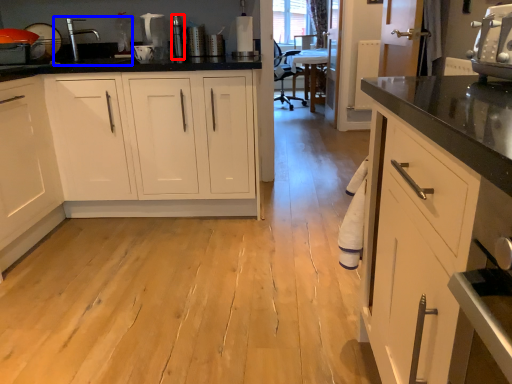
Question: Which point is closer to the camera, appliance (highlighted by a red box) or sink (highlighted by a blue box)?

Choices:
 (A) appliance
 (B) sink

Answer: (B)